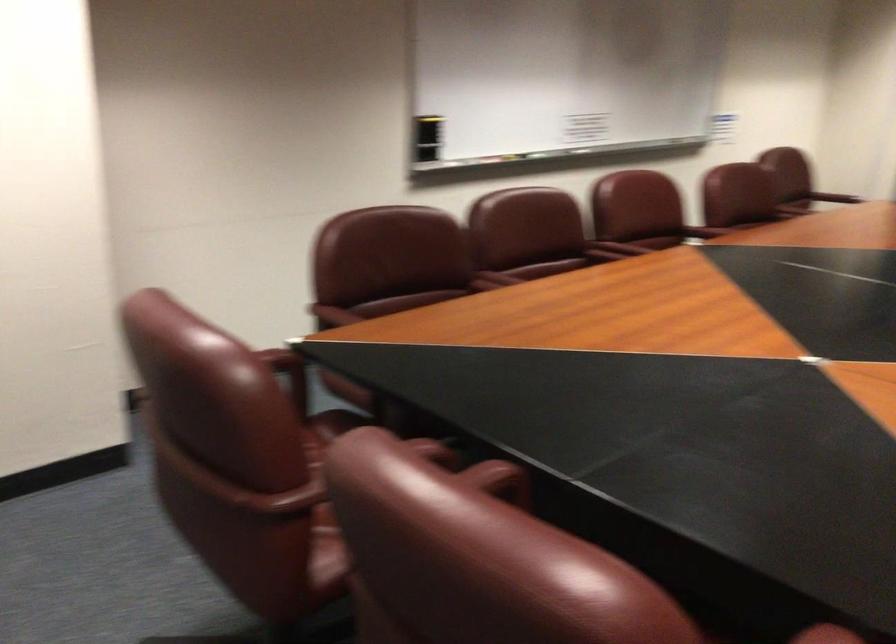
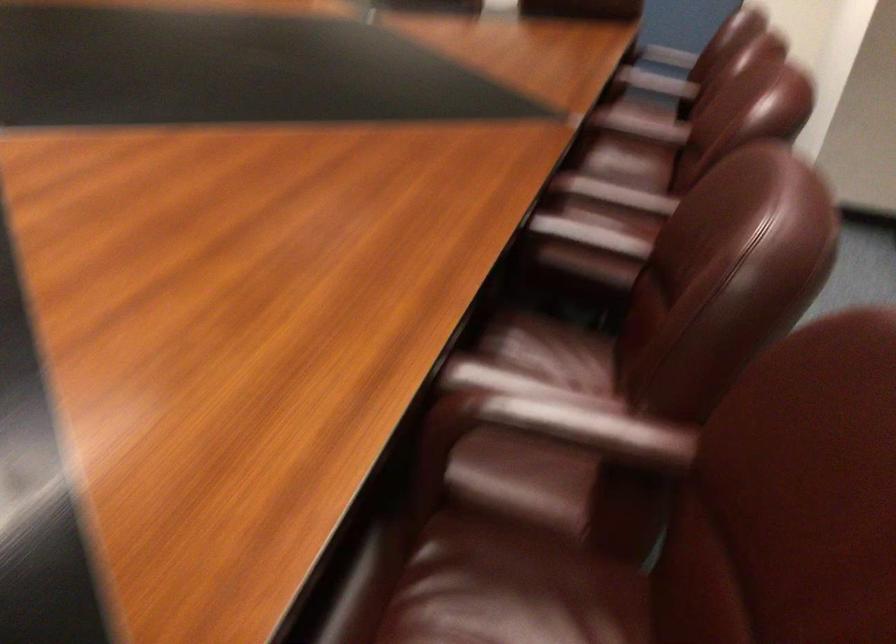
Where in the second image is the point corresponding to point (743, 216) from the first image?

(590, 236)